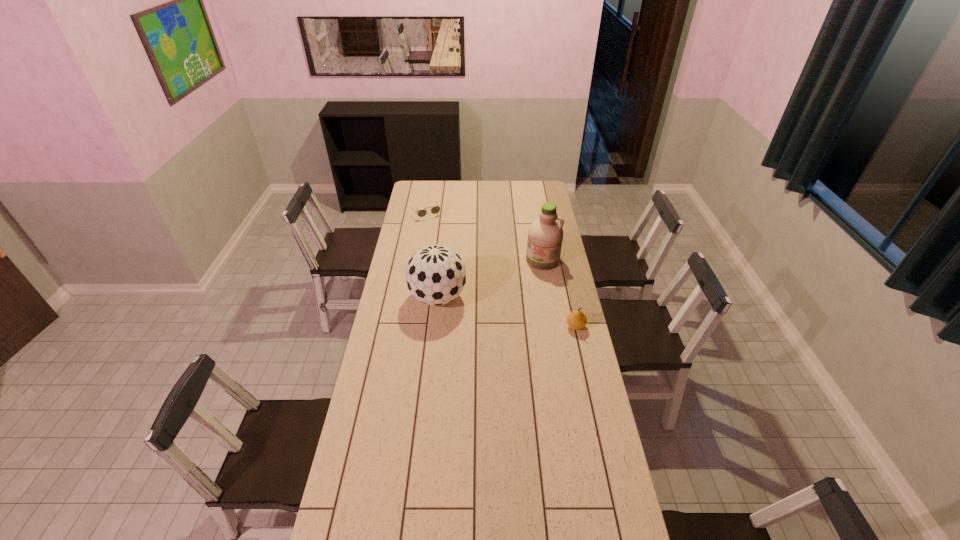
Locate an element on the screen. vacant area located on the front label of the cleansing agent is located at coordinates (524, 302).

I want to click on vacant space located on the front label of the cleansing agent, so [x=518, y=314].

Identify the location of vacant space located on the front label of the cleansing agent. (518, 313).

Find the location of a particular element. The width and height of the screenshot is (960, 540). vacant space located on the front lenses of the shortest object is located at coordinates (455, 255).

Locate an element on the screen. free region located on the front lenses of the shortest object is located at coordinates (436, 227).

Locate an element on the screen. This screenshot has width=960, height=540. free space located on the front lenses of the shortest object is located at coordinates (446, 242).

Where is `soccer ball that is at the left edge`? soccer ball that is at the left edge is located at coordinates (435, 275).

The image size is (960, 540). I want to click on sunglasses that is at the left edge, so click(434, 210).

At what (x,y) coordinates should I click in order to perform the action: click on pear that is at the right edge. Please return your answer as a coordinate pair (x, y). The image size is (960, 540). Looking at the image, I should click on (576, 320).

Locate an element on the screen. The width and height of the screenshot is (960, 540). cleansing agent that is at the right edge is located at coordinates (545, 235).